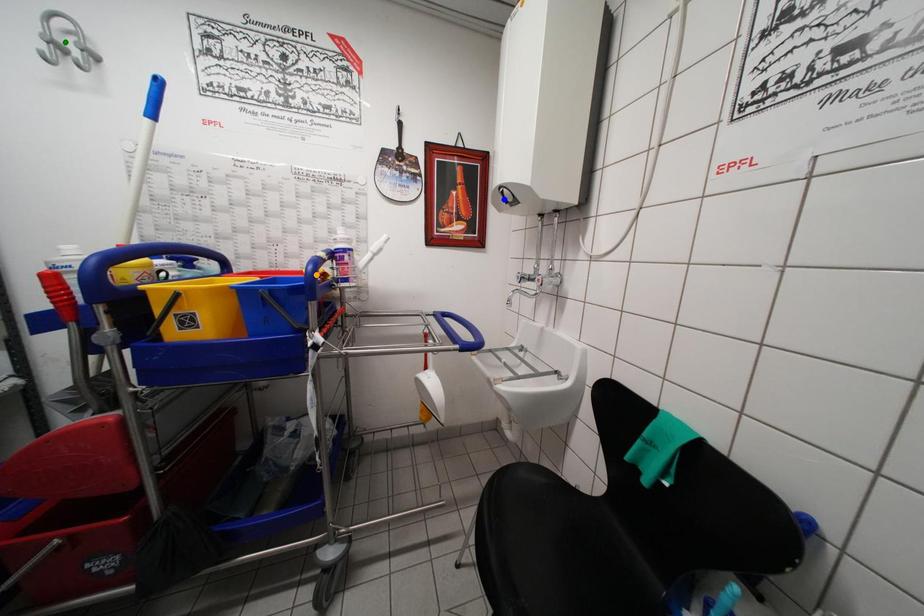
Order these from nearest to farthest:
A) orange point
B) green point
C) blue point

green point
orange point
blue point